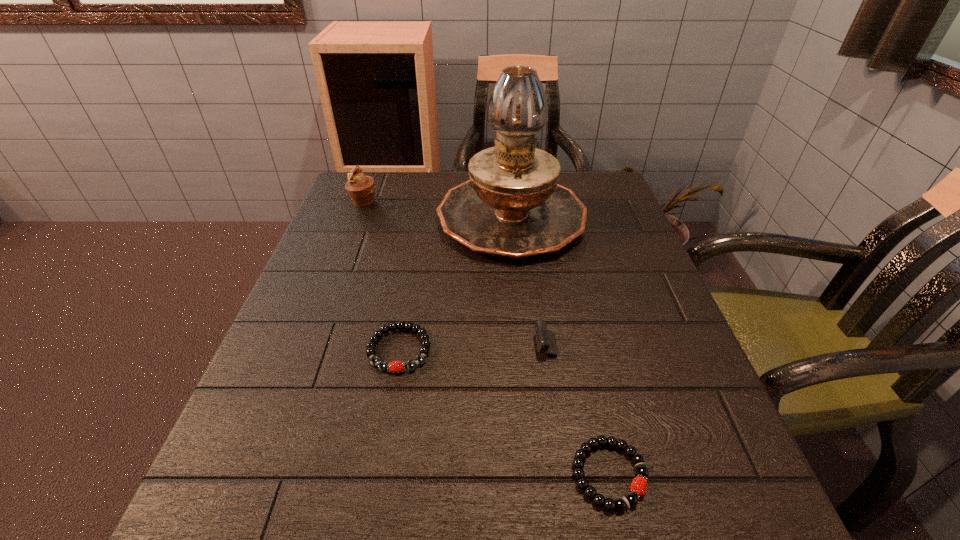
The width and height of the screenshot is (960, 540). What are the coordinates of `the tallest object` in the screenshot? It's located at (512, 207).

Where is `muffin`? Image resolution: width=960 pixels, height=540 pixels. muffin is located at coordinates (361, 189).

Identify the location of the leftmost object. tap(361, 189).

Locate an element on the screen. webcam is located at coordinates (546, 340).

Find the location of a particular element. The width and height of the screenshot is (960, 540). the left bracelet is located at coordinates (393, 367).

What are the coordinates of `the right bracelet` in the screenshot? It's located at [x=620, y=504].

The width and height of the screenshot is (960, 540). Identify the location of the nearest object. (620, 504).

What are the coordinates of `vacant space situated on the left of the oil lamp` in the screenshot? It's located at (398, 217).

The image size is (960, 540). I want to click on vacant space located on the right of the second tallest object, so click(x=400, y=203).

You are a GUI agent. You are given a task and a screenshot of the screen. Output one action in this format:
    pyautogui.click(x=<x>, y=<y>)
    Task: Click on the vacant area located 0.130m on the front-facing side of the third tallest object
    The image size is (960, 540).
    Given the screenshot: What is the action you would take?
    pyautogui.click(x=465, y=343)